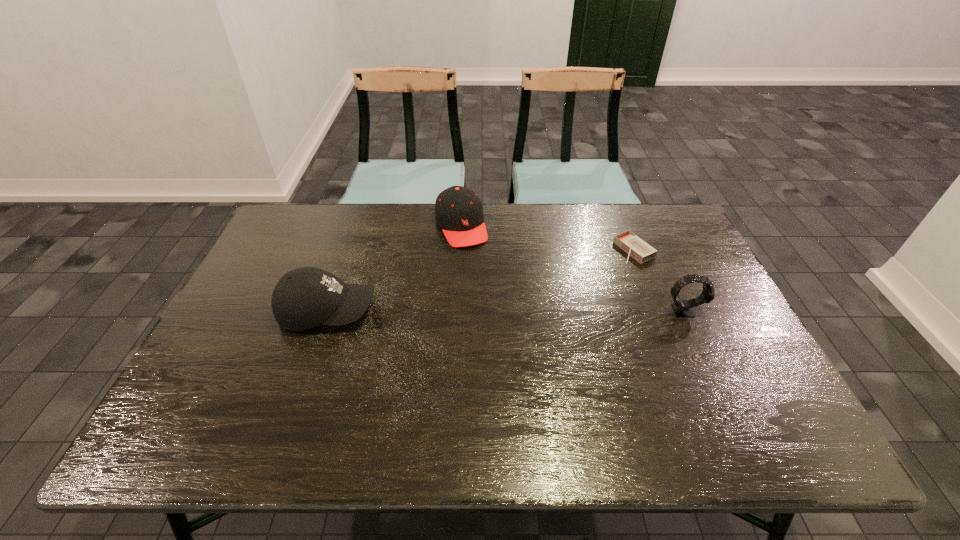
Locate an element on the screen. free region at the right edge is located at coordinates coord(707,312).

In the image, there is a desktop. Identify the location of blank space at the far left corner. This screenshot has width=960, height=540. (315, 246).

The height and width of the screenshot is (540, 960). In the image, there is a desktop. In order to click on vacant area at the far right corner in this screenshot , I will do `click(646, 241)`.

Image resolution: width=960 pixels, height=540 pixels. I want to click on vacant region between the matchbox and the cap, so click(547, 238).

This screenshot has height=540, width=960. What are the coordinates of `free space between the leftmost object and the cap` in the screenshot? It's located at (395, 268).

Find the location of a particular element. This screenshot has width=960, height=540. vacant area between the leftmost object and the watch is located at coordinates (506, 310).

You are a GUI agent. You are given a task and a screenshot of the screen. Output one action in this format:
    pyautogui.click(x=<x>, y=<y>)
    Task: Click on the free spot between the second object from left to right and the matchbox
    This screenshot has width=960, height=540.
    Given the screenshot: What is the action you would take?
    pyautogui.click(x=547, y=238)

Where is `free space between the watch and the leftmost object`? The height and width of the screenshot is (540, 960). free space between the watch and the leftmost object is located at coordinates pyautogui.click(x=506, y=310).

I want to click on blank region between the matchbox and the third object from right to left, so click(547, 238).

This screenshot has width=960, height=540. I want to click on unoccupied area between the baseball cap and the shortest object, so click(x=481, y=280).